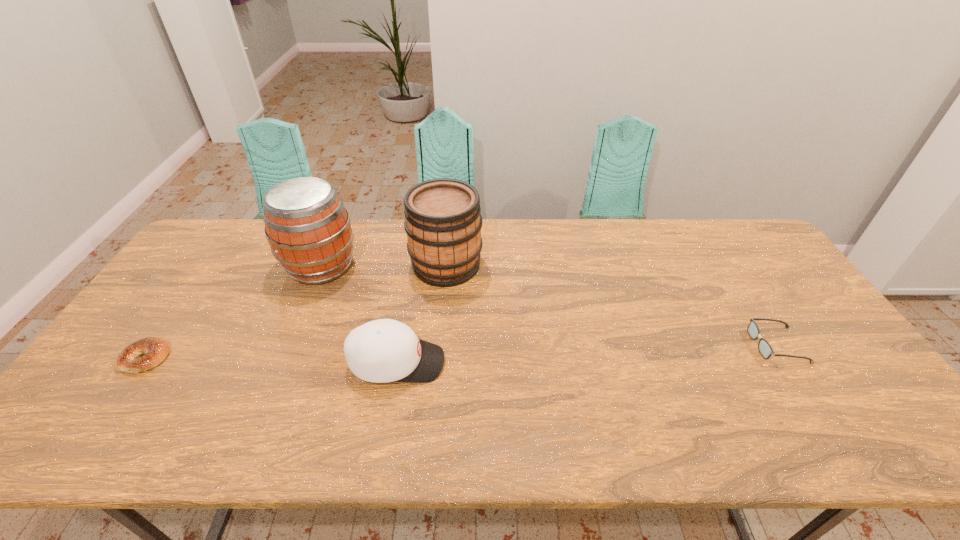
You are a GUI agent. You are given a task and a screenshot of the screen. Output one action in this format:
    pyautogui.click(x=<x>, y=<y>)
    Task: Click on the free spot between the spectacles and the leftmost object
    The height and width of the screenshot is (540, 960).
    Given the screenshot: What is the action you would take?
    pyautogui.click(x=462, y=352)

Identify which object is located as the nearest to the rightmost object. Please provide its 2D coordinates. Your answer should be formatted as a tuple, i.e. [(x, y)], where the tuple contains the x and y coordinates of a point satisfying the conditions above.

[(443, 222)]

Select which object appears as the second closest to the spectacles. Please provide its 2D coordinates. Your answer should be formatted as a tuple, i.e. [(x, y)], where the tuple contains the x and y coordinates of a point satisfying the conditions above.

[(385, 350)]

The image size is (960, 540). I want to click on vacant position in the image that satisfies the following two spatial constraints: 1. on the back side of the right cider; 2. on the right side of the fourth object from right to left, so click(x=322, y=265).